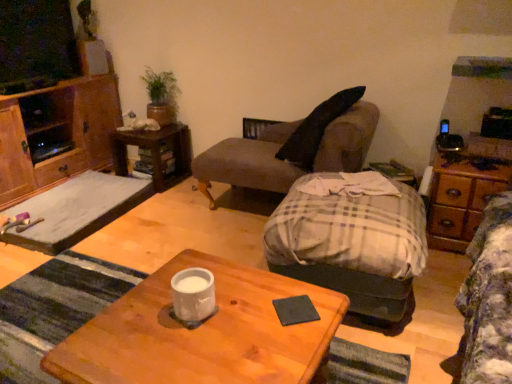
Identify the location of vacant location behind black matte coaster at center. (281, 285).